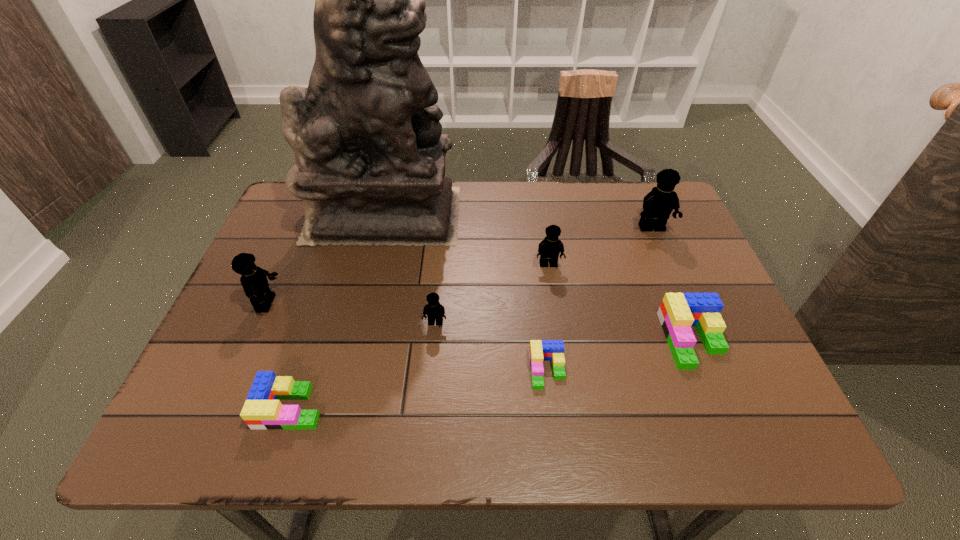
Find the location of a particular element. This screenshot has height=540, width=960. the biggest green Lego is located at coordinates (679, 311).

Identify the location of the second Lego from left to right. The width and height of the screenshot is (960, 540). (262, 410).

Locate an element on the screen. The width and height of the screenshot is (960, 540). the leftmost green Lego is located at coordinates (262, 410).

Where is `the shortest object`? the shortest object is located at coordinates (540, 350).

Find the location of `the shortest Lego`. the shortest Lego is located at coordinates (540, 350).

Locate an element on the screen. This screenshot has height=540, width=960. vacant space located on the front-facing side of the tallest object is located at coordinates (491, 214).

Locate an element on the screen. This screenshot has width=960, height=540. free space located on the front-facing side of the farthest yellow Lego is located at coordinates (680, 295).

The width and height of the screenshot is (960, 540). I want to click on vacant area situated on the front-facing side of the second biggest yellow Lego, so click(336, 303).

Find the location of a particular element. vacant space located 0.330m on the front-facing side of the sixth nearest Lego is located at coordinates tap(567, 390).

Find the location of a particular element. vacant space located on the front-facing side of the fourth shortest object is located at coordinates (427, 418).